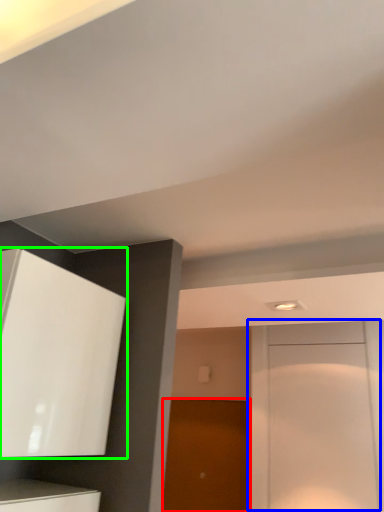
Question: Which object is the closest to the door (highlighted by a red box)? Choose among these: door (highlighted by a blue box) or cabinetry (highlighted by a green box).

Choices:
 (A) door
 (B) cabinetry

Answer: (A)